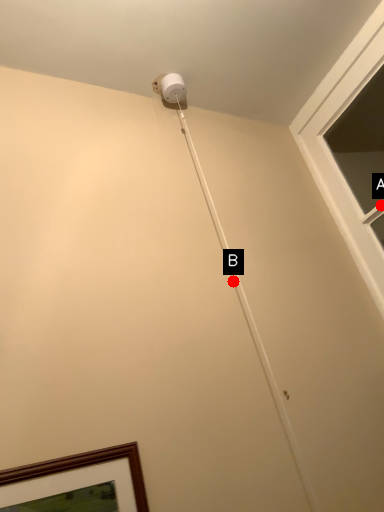
Question: Two points are circled on the image, labeled by A and B beside each circle. Which point appears closest to the camera in this image?

Choices:
 (A) A is closer
 (B) B is closer

Answer: (B)